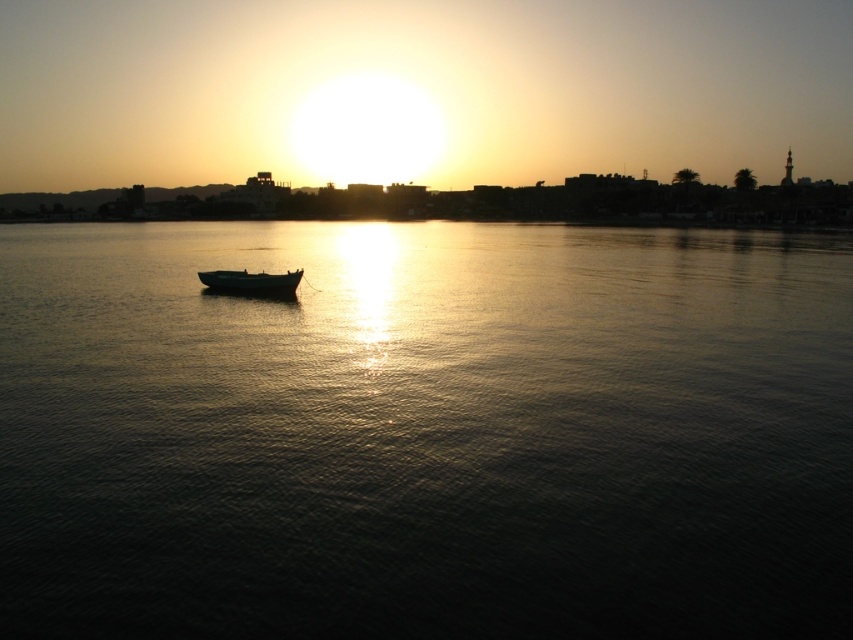
You are an observer standing on the shore looking at the dark water at center and the wooden boat at center. Which object is closer to the horizon?

The wooden boat at center is closer to the horizon because the dark water at center is above it, meaning the boat is positioned lower in the scene and thus farther away from the observer, making it nearer to the horizon.

You are standing on the shore observing the wooden boat at center and the dark water at center. Which object is positioned to the right of the other?

The dark water at center is to the right of the wooden boat at center.

You are standing on the shore of the lake and see the dark water at center and the wooden boat at center. Which object is closer to you?

The dark water at center is closer to the viewer than the wooden boat at center.